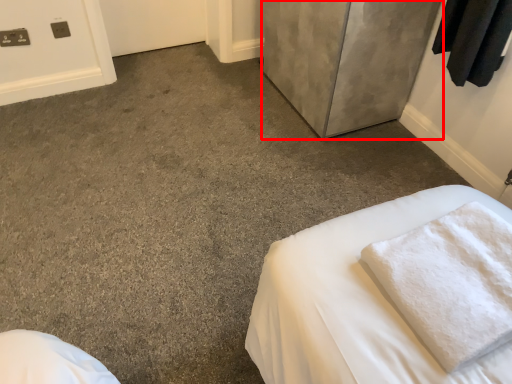
Question: From the image's perspective, what is the correct spatial positioning of door (annotated by the red box) in reference to bath towel?

Choices:
 (A) above
 (B) below

Answer: (A)